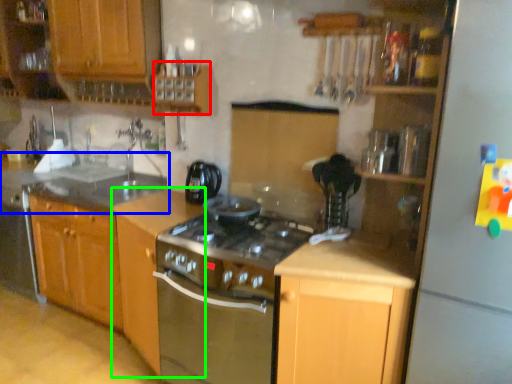
Question: Based on their relative distances, which object is farther from cabinetry (highlighted by a red box)? Choose from countertop (highlighted by a blue box) and cabinetry (highlighted by a green box).

Choices:
 (A) countertop
 (B) cabinetry

Answer: (A)